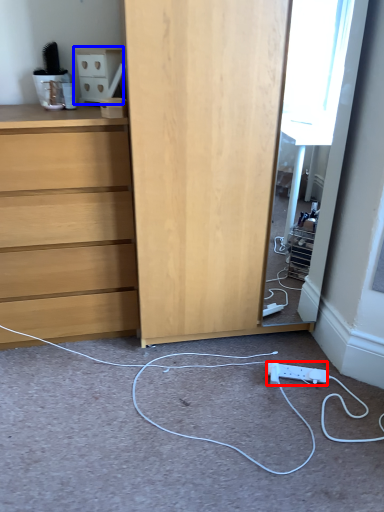
Question: Which point is further to the camera, electric outlet (highlighted by a red box) or cabinetry (highlighted by a blue box)?

Choices:
 (A) electric outlet
 (B) cabinetry

Answer: (A)